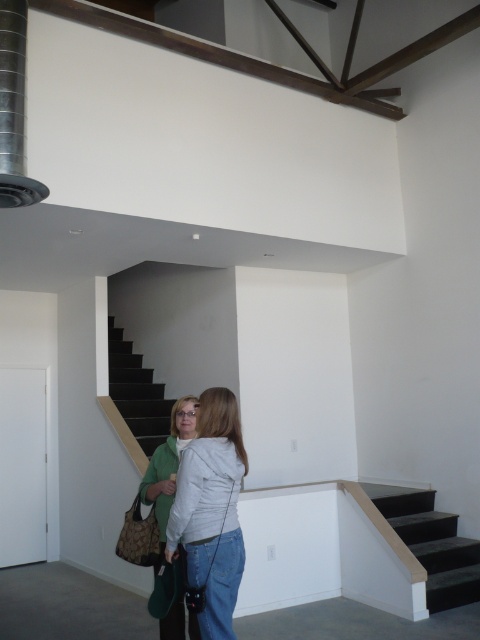
Question: Which object is positioned closest to the green fabric jacket at lower left?

Choices:
 (A) dark gray carpeted stairs at lower right
 (B) white matte jacket at center
 (C) black matte stairwell at center

Answer: (B)

Question: Which point is farther from the camera taking this photo?

Choices:
 (A) (128, 417)
 (B) (434, 544)
 (C) (229, 480)

Answer: (A)

Question: Is white matte jacket at center thinner than black matte stairwell at center?

Choices:
 (A) no
 (B) yes

Answer: (B)

Question: Does white matte jacket at center appear over dark gray carpeted stairs at lower right?

Choices:
 (A) yes
 (B) no

Answer: (A)

Question: Is dark gray carpeted stairs at lower right closer to camera compared to black matte stairwell at center?

Choices:
 (A) yes
 (B) no

Answer: (A)

Question: Which object appears farthest from the camera in this image?

Choices:
 (A) black matte stairwell at center
 (B) white matte jacket at center
 (C) green fabric jacket at lower left

Answer: (A)